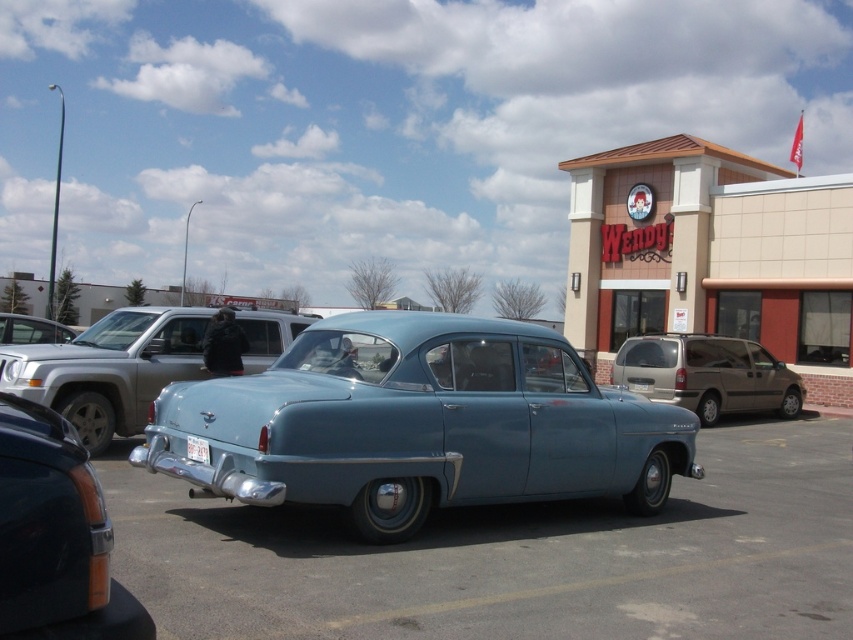
Who is more forward, (634, 481) or (711, 385)?

Positioned in front is point (634, 481).

What do you see at coordinates (419, 424) in the screenshot? I see `light blue metallic car at center` at bounding box center [419, 424].

You are a GUI agent. You are given a task and a screenshot of the screen. Output one action in this format:
    pyautogui.click(x=<x>, y=<y>)
    Task: Click on the light blue metallic car at center
    The height and width of the screenshot is (640, 853).
    Given the screenshot: What is the action you would take?
    pyautogui.click(x=419, y=424)

In the scene shown: Between metallic blue car at center and white plastic license plate at center, which one has less height?

With less height is white plastic license plate at center.

Which is behind, point (212, 608) or point (200, 451)?

The point (200, 451) is more distant.

Is point (824, 518) positioned before point (207, 454)?

No, it is not.

I want to click on metallic blue car at center, so 515,556.

Is metallic blue sedan at center to the left of gold metallic minivan at right from the viewer's perspective?

Yes, metallic blue sedan at center is to the left of gold metallic minivan at right.

Is point (16, 564) farther from camera compared to point (700, 372)?

No, (16, 564) is in front of (700, 372).

I want to click on metallic blue sedan at center, so 55,536.